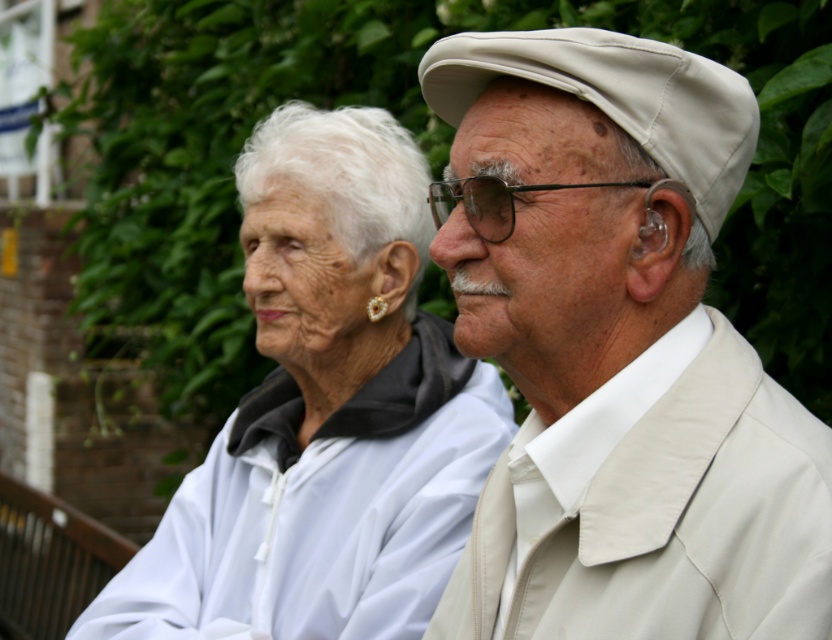
You are a photographer standing 1.7 meters away from the beige fabric cap at upper right. You want to take a photo of the person wearing it without getting closer. What should you do?

Since you are 1.7 meters away from the beige fabric cap at upper right, you can use a zoom lens to capture the person wearing it without moving closer.

You are a photographer setting up equipment in a garden. You have a white matte jacket at center and black plastic goggles at center in your viewfinder. Which object should you adjust your camera focus on first if you want to capture both items in sharp focus?

The white matte jacket at center is located below the black plastic goggles at center. Since the goggles are above the jacket, you should focus on the black plastic goggles at center first to ensure both are in focus as they are vertically aligned.